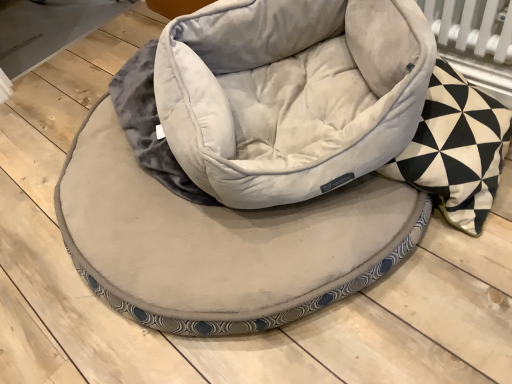
Question: In terms of width, does suede-like beige bean bag chair at center look wider or thinner when compared to velvet-like beige dog bed at center?

Choices:
 (A) wide
 (B) thin

Answer: (B)

Question: Does point (227, 6) appear closer or farther from the camera than point (203, 238)?

Choices:
 (A) farther
 (B) closer

Answer: (A)

Question: Which object is positioned farthest from the velvet-like beige dog bed at center?

Choices:
 (A) suede-like beige bean bag chair at center
 (B) black and white geometric patterned pillow at right

Answer: (B)

Question: Which object is positioned farthest from the velvet-like beige dog bed at center?

Choices:
 (A) suede-like beige bean bag chair at center
 (B) black and white geometric patterned pillow at right

Answer: (B)